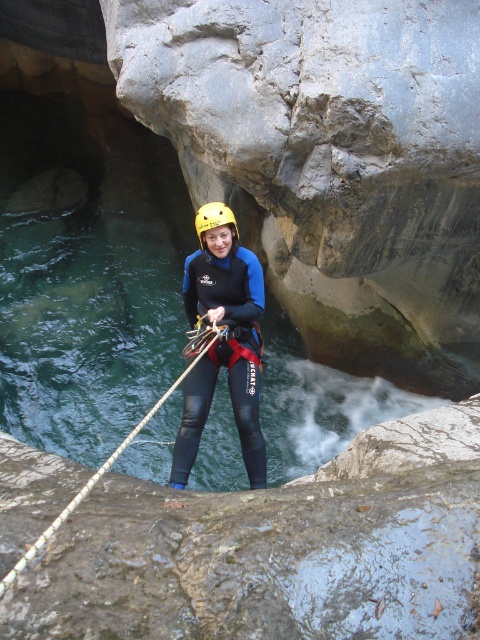
Is matte black wetsuit at center in front of roperoughrope at center?

No, it is behind roperoughrope at center.

Can you confirm if matte black wetsuit at center is thinner than roperoughrope at center?

Yes.

Locate an element on the screen. The image size is (480, 640). matte black wetsuit at center is located at coordinates (223, 340).

Describe the element at coordinates (120, 444) in the screenshot. This screenshot has height=640, width=480. I see `roperoughrope at center` at that location.

Is point (187, 355) positioned in front of point (226, 216)?

No, it is behind (226, 216).

The height and width of the screenshot is (640, 480). Find the location of `roperoughrope at center`. roperoughrope at center is located at coordinates (120, 444).

Is matte black wetsuit at center bigger than yellow matte helmet at center?

Yes, matte black wetsuit at center is bigger than yellow matte helmet at center.

Who is positioned more to the right, matte black wetsuit at center or yellow matte helmet at center?

From the viewer's perspective, yellow matte helmet at center appears more on the right side.

Where is `matte black wetsuit at center`? matte black wetsuit at center is located at coordinates (223, 340).